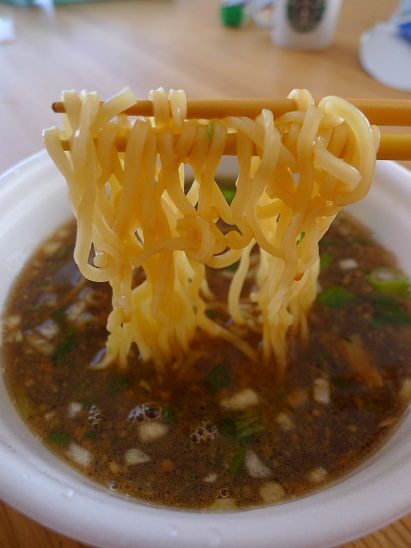
Find the location of `bowl`. bowl is located at coordinates (47, 181).